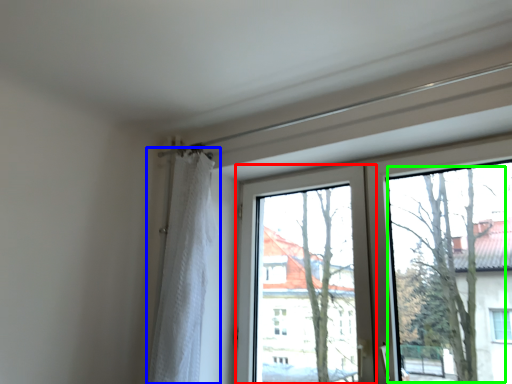
Question: Which object is positioned closest to window screen (highlighted by a red box)? Select from curtain (highlighted by a blue box) and tree (highlighted by a green box).

Choices:
 (A) curtain
 (B) tree

Answer: (B)